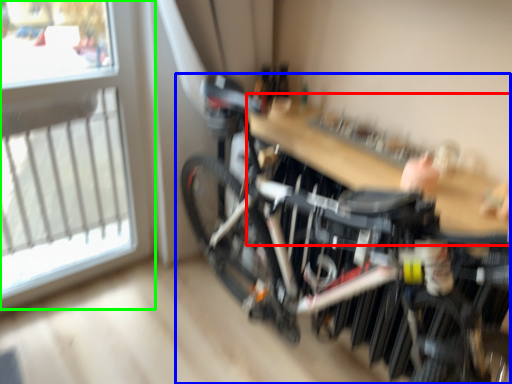
Question: Which is farther away from table (highlighted by a red box)? bicycle (highlighted by a blue box) or window (highlighted by a green box)?

Choices:
 (A) bicycle
 (B) window

Answer: (B)